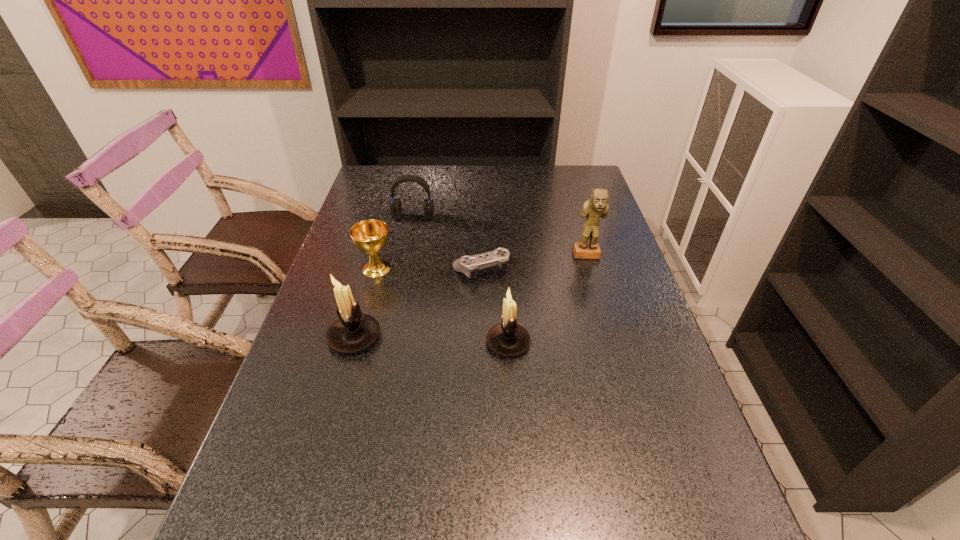
The width and height of the screenshot is (960, 540). In order to click on the left candle holder in this screenshot , I will do `click(354, 331)`.

Find the location of a particular element. The height and width of the screenshot is (540, 960). the right candle holder is located at coordinates (508, 338).

Locate an element on the screen. headset is located at coordinates (395, 206).

Find the location of `figurine`. figurine is located at coordinates (596, 207).

Locate an element on the screen. The height and width of the screenshot is (540, 960). control is located at coordinates (468, 265).

Identify the location of chalice. The height and width of the screenshot is (540, 960). (370, 236).

What are the coordinates of `free space located 0.060m on the back of the taller candle holder` in the screenshot? It's located at (365, 302).

You are a GUI agent. You are given a task and a screenshot of the screen. Output one action in this format:
    pyautogui.click(x=<x>, y=<y>)
    Task: Click on the free space located on the right of the shorter candle holder
    The width and height of the screenshot is (960, 540).
    Given the screenshot: What is the action you would take?
    pyautogui.click(x=559, y=342)

Image resolution: width=960 pixels, height=540 pixels. Find the location of `free space located on the headband of the headset`. free space located on the headband of the headset is located at coordinates (402, 273).

What are the coordinates of `blank space located 0.120m on the front-facing side of the figurine` in the screenshot? It's located at (596, 288).